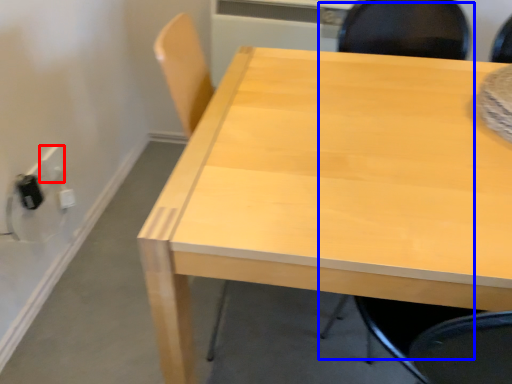
Question: Which of the following is the farthest to the observer, electric outlet (highlighted by a red box) or chair (highlighted by a blue box)?

Choices:
 (A) electric outlet
 (B) chair

Answer: (A)